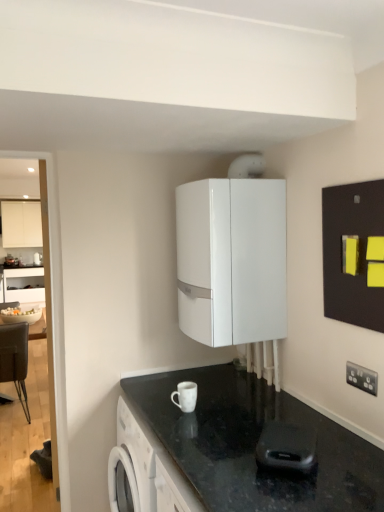
The width and height of the screenshot is (384, 512). Identify the location of white glossy boiler at upper center, arranged as the 2th appliance when viewed from the left. (247, 166).

What do you see at coordinates (286, 447) in the screenshot?
I see `black rubber remote control at lower center, acting as the 3th appliance starting from the top` at bounding box center [286, 447].

Describe the element at coordinates (21, 224) in the screenshot. The width and height of the screenshot is (384, 512). I see `matte white cabinet at upper left, which ranks as the first cabinetry in back-to-front order` at that location.

In order to face white glossy microwave at upper center, should I rotate leftwards or rightwards?

You should look left and rotate roughly 20.059 degrees.

What is the approximate width of white plastic electric outlet at lower right?

1.34 centimeters.

Describe the element at coordinates (362, 378) in the screenshot. I see `white plastic electric outlet at lower right` at that location.

Locate an element on the screen. The width and height of the screenshot is (384, 512). white glossy boiler at center, the second cabinetry positioned from the left is located at coordinates (232, 260).

Between black rubber remote control at lower center, arranged as the 3th appliance when viewed from the back, and black granite countertop at lower center, which one has more height?

Standing taller between the two is black rubber remote control at lower center, arranged as the 3th appliance when viewed from the back.

Is black rubber remote control at lower center, acting as the 3th appliance starting from the top, bigger or smaller than black granite countertop at lower center?

Considering their sizes, black rubber remote control at lower center, acting as the 3th appliance starting from the top, takes up less space than black granite countertop at lower center.

Locate an element on the screen. This screenshot has height=512, width=384. the 1st appliance above the black granite countertop at lower center (from a real-world perspective) is located at coordinates (286, 447).

What's the angular difference between matte white cabinet at upper left, which ranks as the first cabinetry in back-to-front order, and black granite countertop at lower center's facing directions?

90 degrees.

From a real-world perspective, who is located lower, matte white cabinet at upper left, the 2th cabinetry positioned from the front, or black granite countertop at lower center?

From a 3D spatial view, black granite countertop at lower center is below.

Is the depth of matte white cabinet at upper left, which ranks as the first cabinetry in back-to-front order, less than that of black granite countertop at lower center?

No, matte white cabinet at upper left, which ranks as the first cabinetry in back-to-front order, is further to the viewer.

Consider the image. Which of these two, matte white cabinet at upper left, which appears as the second cabinetry when ordered from the bottom, or black granite countertop at lower center, stands shorter?

Standing shorter between the two is black granite countertop at lower center.

Considering the relative sizes of white glossy boiler at center, arranged as the 2th cabinetry when viewed from the top, and black granite countertop at lower center in the image provided, is white glossy boiler at center, arranged as the 2th cabinetry when viewed from the top, shorter than black granite countertop at lower center?

In fact, white glossy boiler at center, arranged as the 2th cabinetry when viewed from the top, may be taller than black granite countertop at lower center.

From the image's perspective, is white glossy boiler at center, which is the 1th cabinetry in bottom-to-top order, beneath black granite countertop at lower center?

No.

Consider the image. Does white glossy boiler at center, marked as the 2th cabinetry in a back-to-front arrangement, have a lesser width compared to black granite countertop at lower center?

Yes, white glossy boiler at center, marked as the 2th cabinetry in a back-to-front arrangement, is thinner than black granite countertop at lower center.

Image resolution: width=384 pixels, height=512 pixels. I want to click on countertop below the white glossy boiler at center, which is the 1th cabinetry in bottom-to-top order (from the image's perspective), so click(x=255, y=445).

Considering the relative positions of brown leather chair at left and white glossy boiler at upper center, the first appliance positioned from the top, in the image provided, is brown leather chair at left behind white glossy boiler at upper center, the first appliance positioned from the top,?

Yes, the depth of brown leather chair at left is greater than that of white glossy boiler at upper center, the first appliance positioned from the top.

Based on the photo, which is closer to the camera, (1, 327) or (255, 170)?

Point (1, 327).

Where is `the 3rd appliance above the brown leather chair at left (from the image's perspective)`? The image size is (384, 512). the 3rd appliance above the brown leather chair at left (from the image's perspective) is located at coordinates (247, 166).

Which of these two, brown leather chair at left or white glossy boiler at upper center, which ranks as the 1th appliance in back-to-front order, is bigger?

brown leather chair at left.

Consider the image. Are black granite countertop at lower center and white glossy boiler at center, the 1th cabinetry when ordered from front to back, making contact?

No, black granite countertop at lower center is not beside white glossy boiler at center, the 1th cabinetry when ordered from front to back.

Is black granite countertop at lower center inside the boundaries of white glossy boiler at center, the second cabinetry positioned from the left, or outside?

black granite countertop at lower center lies outside white glossy boiler at center, the second cabinetry positioned from the left.

Which of these two, black granite countertop at lower center or white glossy boiler at center, the second cabinetry positioned from the left, stands taller?

Standing taller between the two is white glossy boiler at center, the second cabinetry positioned from the left.

How different are the orientations of black granite countertop at lower center and white glossy boiler at center, the second cabinetry positioned from the left, in degrees?

1.86 degrees.

From a real-world perspective, which object stands above the other?

white glossy microwave at upper center.

Which of these two, black granite countertop at lower center or white glossy microwave at upper center, is wider?

With larger width is black granite countertop at lower center.

Is black granite countertop at lower center positioned behind white glossy microwave at upper center?

No, it is not.

Can you confirm if black granite countertop at lower center is bigger than white glossy microwave at upper center?

Yes, black granite countertop at lower center is bigger than white glossy microwave at upper center.

Considering the relative sizes of white glossy boiler at center, arranged as the 2th cabinetry when viewed from the top, and white plastic electric outlet at lower right in the image provided, is white glossy boiler at center, arranged as the 2th cabinetry when viewed from the top, thinner than white plastic electric outlet at lower right?

No.

Is white plastic electric outlet at lower right at the back of white glossy boiler at center, the 1th cabinetry when ordered from front to back?

white glossy boiler at center, the 1th cabinetry when ordered from front to back, does not have its back to white plastic electric outlet at lower right.

Are white glossy boiler at center, acting as the 1th cabinetry starting from the right, and white plastic electric outlet at lower right making contact?

No.

From a real-world perspective, is white glossy boiler at center, the 1th cabinetry when ordered from front to back, below white plastic electric outlet at lower right?

Actually, white glossy boiler at center, the 1th cabinetry when ordered from front to back, is physically above white plastic electric outlet at lower right in the real world.

Where is `appliance that is the 1st one when counting upward from the black granite countertop at lower center (from the image's perspective)`? appliance that is the 1st one when counting upward from the black granite countertop at lower center (from the image's perspective) is located at coordinates (286, 447).

The image size is (384, 512). What are the coordinates of `the 2nd cabinetry behind the black granite countertop at lower center, starting your count from the anchor` in the screenshot? It's located at (21, 224).

In the scene shown: Which object lies nearer to the anchor point black rubber remote control at lower center, the first appliance in the right-to-left sequence, white glossy boiler at center, which is the 1th cabinetry in bottom-to-top order, or white glossy boiler at upper center, which ranks as the 1th appliance in back-to-front order?

Based on the image, white glossy boiler at center, which is the 1th cabinetry in bottom-to-top order, appears to be nearer to black rubber remote control at lower center, the first appliance in the right-to-left sequence.

Considering their positions, is white plastic electric outlet at lower right positioned closer to matte white cabinet at upper left, which appears as the second cabinetry when ordered from the bottom, than white glossy microwave at upper center?

Among the two, white glossy microwave at upper center is located nearer to matte white cabinet at upper left, which appears as the second cabinetry when ordered from the bottom.

Considering their positions, is white glossy mug at lower center, the 2th appliance viewed from the front, positioned closer to black rubber remote control at lower center, placed as the third appliance when sorted from left to right, than white glossy boiler at center, which is the 1th cabinetry in bottom-to-top order?

Based on the image, white glossy mug at lower center, the 2th appliance viewed from the front, appears to be nearer to black rubber remote control at lower center, placed as the third appliance when sorted from left to right.

Looking at this image, which object lies further to the anchor point matte white cabinet at upper left, which appears as the second cabinetry when ordered from the bottom, black rubber remote control at lower center, the first appliance in the right-to-left sequence, or white plastic electric outlet at lower right?

Based on the image, white plastic electric outlet at lower right appears to be further to matte white cabinet at upper left, which appears as the second cabinetry when ordered from the bottom.

Based on the photo, considering their positions, is white glossy boiler at center, acting as the 1th cabinetry starting from the right, positioned further to matte white cabinet at upper left, which ranks as the first cabinetry in back-to-front order, than white glossy mug at lower center, the third appliance positioned from the right?

white glossy mug at lower center, the third appliance positioned from the right, is positioned further to the anchor matte white cabinet at upper left, which ranks as the first cabinetry in back-to-front order.

When comparing their distances from white glossy boiler at center, the second cabinetry positioned from the left, does brown leather chair at left or white glossy mug at lower center, the first appliance viewed from the left, seem closer?

white glossy mug at lower center, the first appliance viewed from the left.

When comparing their distances from white plastic electric outlet at lower right, does matte white cabinet at upper left, marked as the first cabinetry in a top-to-bottom arrangement, or black rubber remote control at lower center, the first appliance in the right-to-left sequence, seem closer?

The object closer to white plastic electric outlet at lower right is black rubber remote control at lower center, the first appliance in the right-to-left sequence.

From the image, which object appears to be nearer to black rubber remote control at lower center, placed as the third appliance when sorted from left to right, brown leather chair at left or white glossy microwave at upper center?

Among the two, brown leather chair at left is located nearer to black rubber remote control at lower center, placed as the third appliance when sorted from left to right.

Where is `appliance located between brown leather chair at left and white glossy boiler at upper center, the 3th appliance from the bottom, in the left-right direction`? The image size is (384, 512). appliance located between brown leather chair at left and white glossy boiler at upper center, the 3th appliance from the bottom, in the left-right direction is located at coordinates (185, 396).

Where is `appliance positioned between white glossy boiler at center, the 1th cabinetry when ordered from front to back, and matte white cabinet at upper left, marked as the first cabinetry in a top-to-bottom arrangement, from near to far`? The width and height of the screenshot is (384, 512). appliance positioned between white glossy boiler at center, the 1th cabinetry when ordered from front to back, and matte white cabinet at upper left, marked as the first cabinetry in a top-to-bottom arrangement, from near to far is located at coordinates (247, 166).

At what (x,y) coordinates should I click in order to perform the action: click on cabinetry located between white plastic electric outlet at lower right and matte white cabinet at upper left, which ranks as the first cabinetry in back-to-front order, in the depth direction. Please return your answer as a coordinate pair (x, y). Image resolution: width=384 pixels, height=512 pixels. Looking at the image, I should click on (232, 260).

Locate an element on the screen. This screenshot has height=512, width=384. chair between white glossy mug at lower center, the second appliance positioned from the bottom, and matte white cabinet at upper left, marked as the first cabinetry in a top-to-bottom arrangement, in the front-back direction is located at coordinates (15, 360).